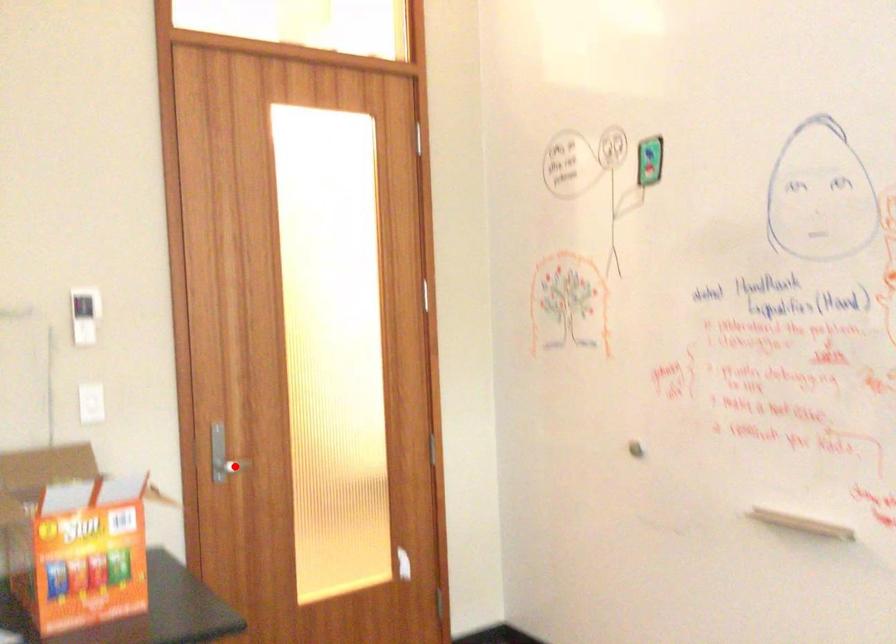
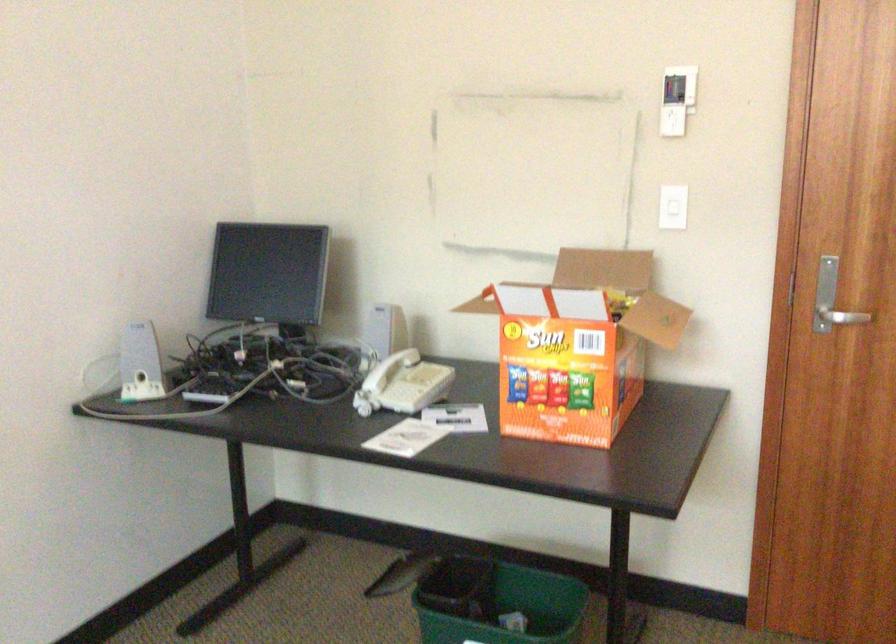
Question: I am providing you with two images of the same scene from different viewpoints. In image1, a red point is highlighted. Considering the same 3D point in image2, which of the following is correct?

Choices:
 (A) It is closer
 (B) It is farther

Answer: (A)